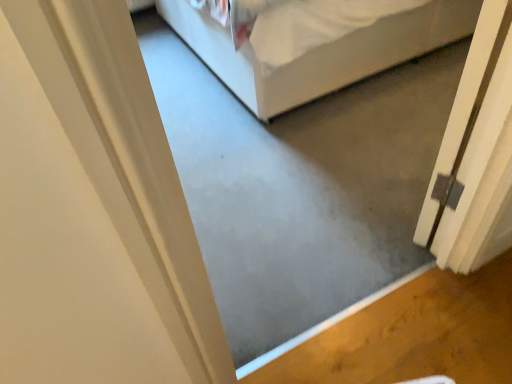
Question: Considering their positions, is white fabric bed at center located in front of or behind white matte door at right?

Choices:
 (A) front
 (B) behind

Answer: (B)

Question: From a real-world perspective, relative to white matte door at right, is white fabric bed at center vertically above or below?

Choices:
 (A) above
 (B) below

Answer: (B)

Question: From the image's perspective, is white fabric bed at center positioned above or below white matte door at right?

Choices:
 (A) above
 (B) below

Answer: (A)

Question: Would you say white matte door at right is to the left or to the right of white fabric bed at center in the picture?

Choices:
 (A) right
 (B) left

Answer: (A)

Question: From their relative heights in the image, would you say white matte door at right is taller or shorter than white fabric bed at center?

Choices:
 (A) short
 (B) tall

Answer: (B)

Question: Looking at the image, does white matte door at right seem bigger or smaller compared to white fabric bed at center?

Choices:
 (A) big
 (B) small

Answer: (B)

Question: From a real-world perspective, is white matte door at right positioned above or below white fabric bed at center?

Choices:
 (A) below
 (B) above

Answer: (B)